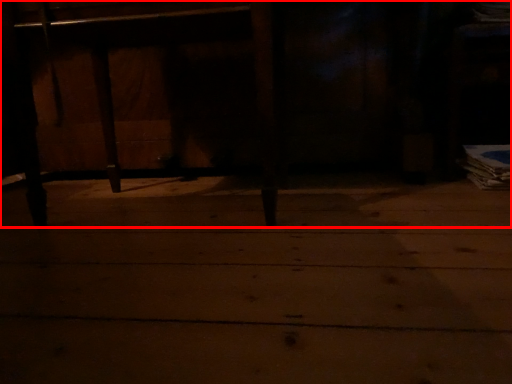
Question: Where is furniture (annotated by the red box) located in relation to concrete in the image?

Choices:
 (A) right
 (B) left

Answer: (B)